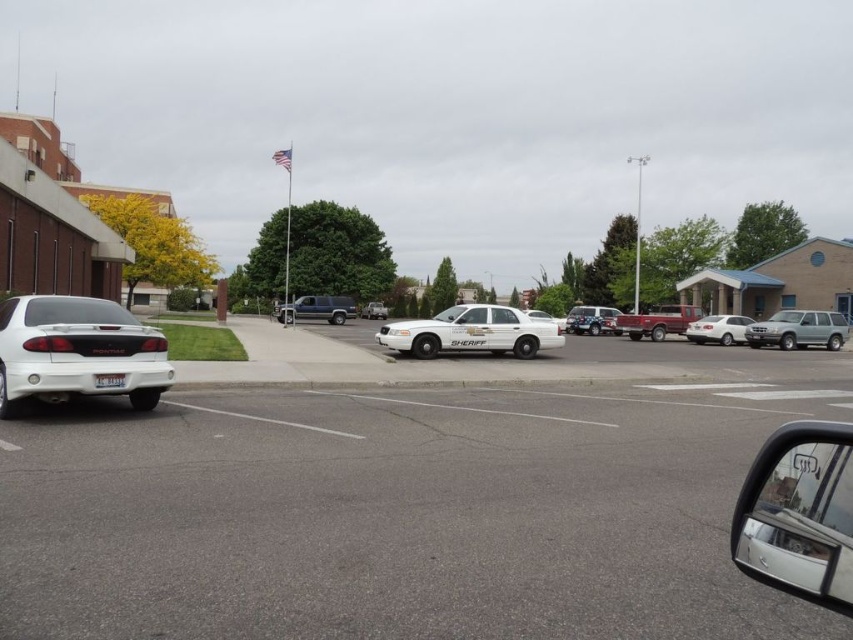
You are standing in the parking lot and want to walk to a specific location. You have two points to choose from. The first point is at coordinates point [343,314] and the second is at point [380,308]. Which point is closer to you?

Point [343,314] is closer to the camera than point [380,308], so the first point is closer to you.